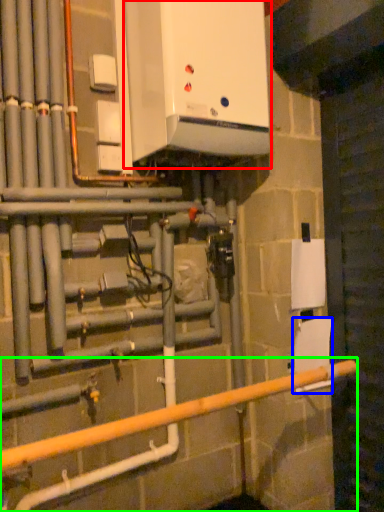
Question: Which is nearer to the home appliance (highlighted by a red box)? toilet paper (highlighted by a blue box) or rail (highlighted by a green box).

Choices:
 (A) toilet paper
 (B) rail

Answer: (A)